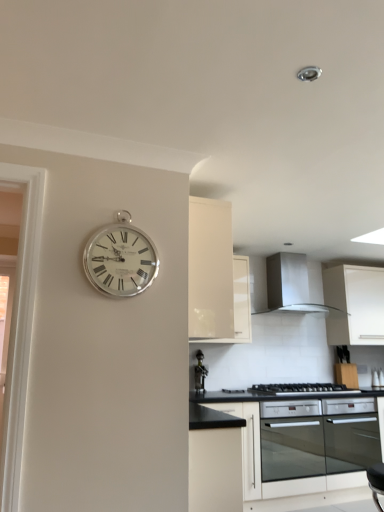
Locate an element on the screen. free space above satin silver exhaust hood at upper center (from a real-world perspective) is located at coordinates (297, 252).